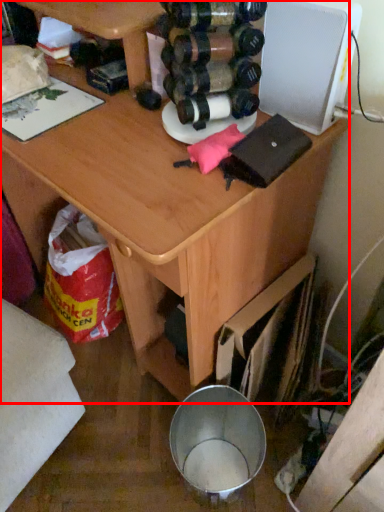
Question: From the image's perspective, what is the correct spatial relationship of desk (annotated by the red box) in relation to appliance?

Choices:
 (A) above
 (B) below

Answer: (B)